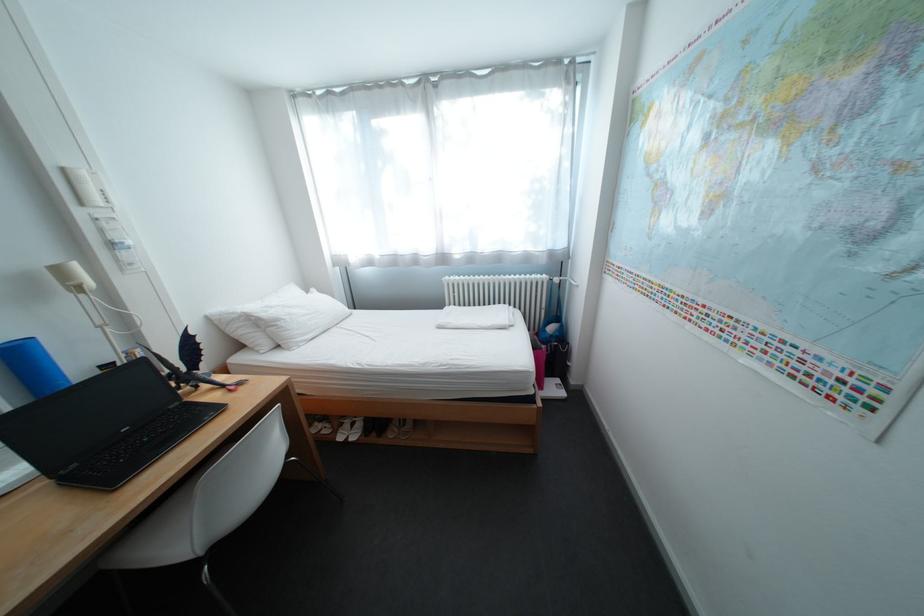
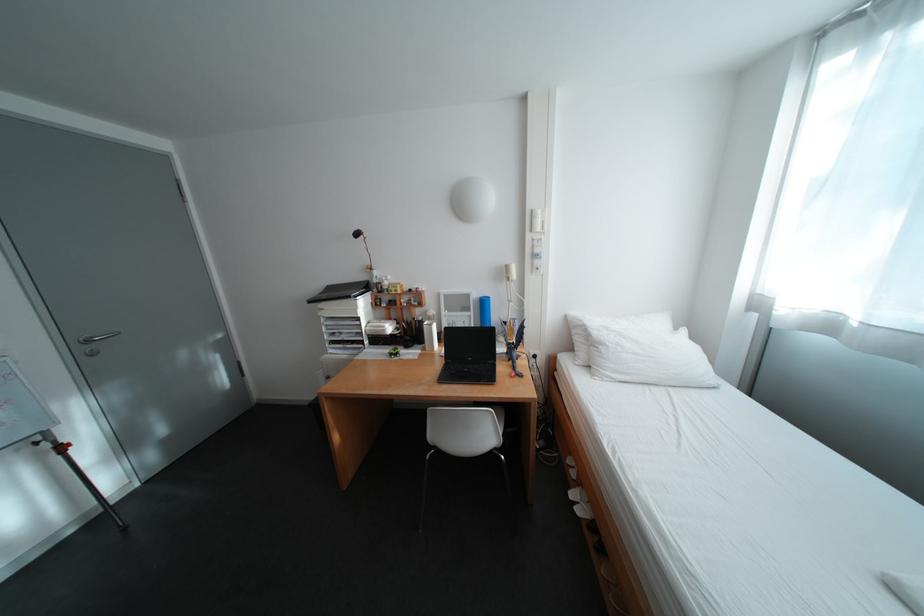
In the second image, find the point that corresponds to point (292, 322) in the first image.

(614, 346)